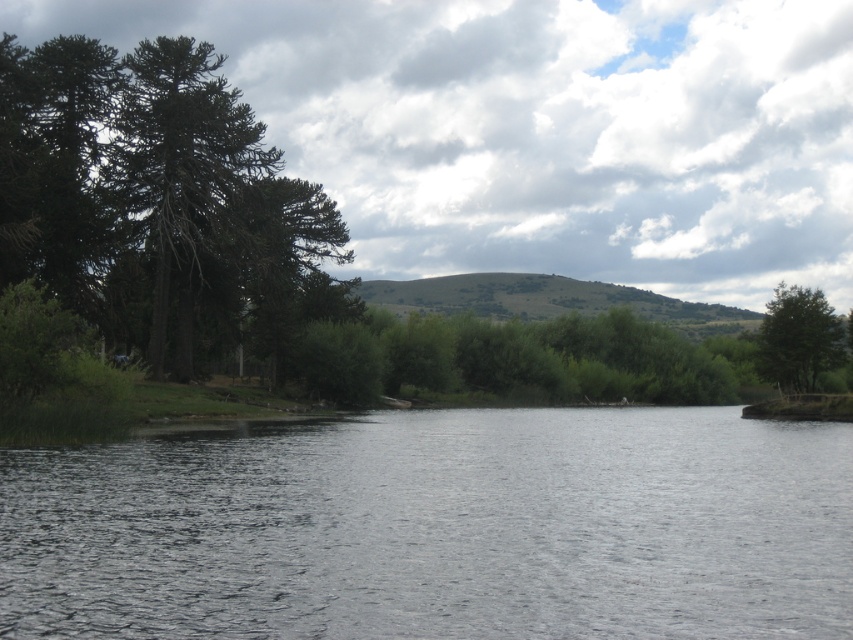
Question: Which is nearer to the green leafy tree at right?

Choices:
 (A) green rough bark tree at left
 (B) clear water at center

Answer: (B)

Question: Is green rough bark tree at left closer to the viewer compared to green leafy tree at right?

Choices:
 (A) no
 (B) yes

Answer: (B)

Question: Which object is closer to the camera taking this photo?

Choices:
 (A) green rough bark tree at left
 (B) clear water at center
 (C) green leafy tree at right

Answer: (B)

Question: Does clear water at center appear over green rough bark tree at left?

Choices:
 (A) yes
 (B) no

Answer: (B)

Question: Which point is closer to the camera?

Choices:
 (A) (198, 216)
 (B) (784, 378)

Answer: (B)

Question: Is clear water at center thinner than green leafy tree at right?

Choices:
 (A) yes
 (B) no

Answer: (B)